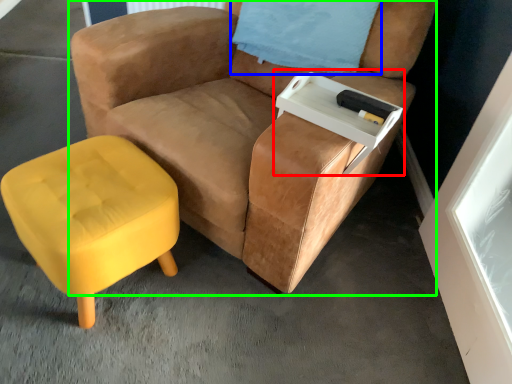
Question: Which object is the closest to the side table (highlighted by a red box)? Choose among these: pillow (highlighted by a blue box) or chair (highlighted by a green box).

Choices:
 (A) pillow
 (B) chair

Answer: (B)